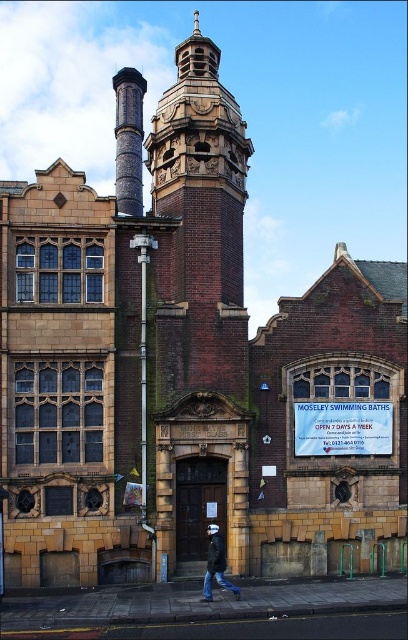
Question: Which object is farther from the camera taking this photo?

Choices:
 (A) rustic stone chimney at upper center
 (B) dark blue jeans at lower center

Answer: (A)

Question: Which point is closer to the camera taking this photo?

Choices:
 (A) (124, 157)
 (B) (212, 595)

Answer: (B)

Question: Can you confirm if rustic stone chimney at upper center is positioned to the left of dark blue jeans at lower center?

Choices:
 (A) yes
 (B) no

Answer: (A)

Question: Which point appears closest to the camera in this image?

Choices:
 (A) (206, 572)
 (B) (132, 145)

Answer: (A)

Question: Considering the relative positions of rustic stone chimney at upper center and dark blue jeans at lower center in the image provided, where is rustic stone chimney at upper center located with respect to dark blue jeans at lower center?

Choices:
 (A) below
 (B) above

Answer: (B)

Question: Can you confirm if rustic stone chimney at upper center is thinner than dark blue jeans at lower center?

Choices:
 (A) yes
 (B) no

Answer: (B)